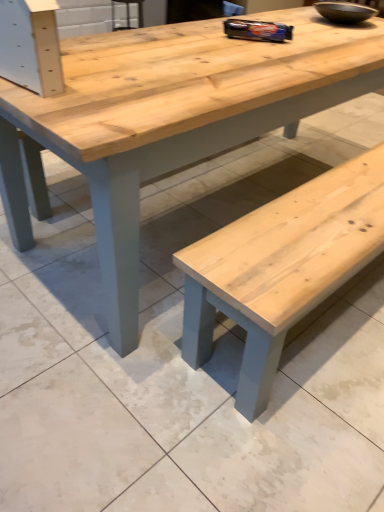
Question: From the image's perspective, is natural wood table at center beneath matte black bowl at upper right?

Choices:
 (A) yes
 (B) no

Answer: (A)

Question: Can you confirm if natural wood table at center is positioned to the right of matte black bowl at upper right?

Choices:
 (A) no
 (B) yes

Answer: (A)

Question: Does natural wood table at center have a smaller size compared to matte black bowl at upper right?

Choices:
 (A) yes
 (B) no

Answer: (B)

Question: From a real-world perspective, does natural wood table at center sit lower than matte black bowl at upper right?

Choices:
 (A) no
 (B) yes

Answer: (B)

Question: From the image's perspective, is natural wood table at center located above matte black bowl at upper right?

Choices:
 (A) yes
 (B) no

Answer: (B)

Question: Is natural wood table at center taller than matte black bowl at upper right?

Choices:
 (A) no
 (B) yes

Answer: (B)

Question: Does matte black bowl at upper right have a larger size compared to natural wood table at center?

Choices:
 (A) yes
 (B) no

Answer: (B)

Question: Are matte black bowl at upper right and natural wood table at center making contact?

Choices:
 (A) yes
 (B) no

Answer: (B)

Question: Could you tell me if matte black bowl at upper right is facing natural wood table at center?

Choices:
 (A) yes
 (B) no

Answer: (B)

Question: Does matte black bowl at upper right have a lesser width compared to natural wood table at center?

Choices:
 (A) yes
 (B) no

Answer: (A)

Question: Could natural wood table at center be considered to be inside matte black bowl at upper right?

Choices:
 (A) no
 (B) yes

Answer: (A)

Question: From the image's perspective, is matte black bowl at upper right under natural wood table at center?

Choices:
 (A) yes
 (B) no

Answer: (B)

Question: In the image, is matte black bowl at upper right on the left side or the right side of natural wood table at center?

Choices:
 (A) right
 (B) left

Answer: (A)